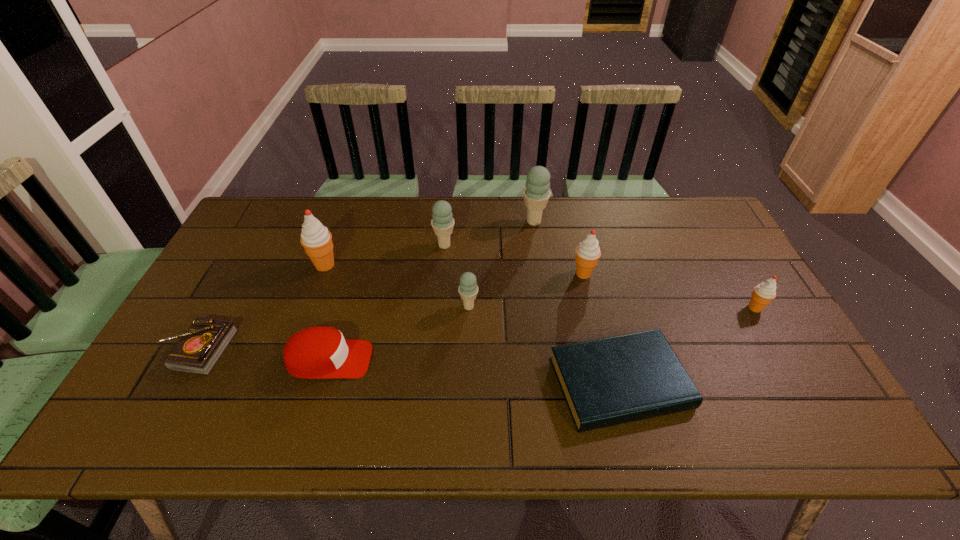
Locate an element on the screen. Image resolution: width=960 pixels, height=540 pixels. vacant space at the right edge is located at coordinates (742, 269).

This screenshot has height=540, width=960. In the image, there is a desktop. Identify the location of free region at the far left corner. (273, 212).

The image size is (960, 540). I want to click on free space at the near left corner of the desktop, so click(x=188, y=434).

In the image, there is a desktop. In order to click on blank space at the far right corner in this screenshot , I will do `click(708, 210)`.

Identify the location of free space between the rightmost red icecream and the book. (687, 346).

The height and width of the screenshot is (540, 960). What are the coordinates of `vacant space that's between the second red icecream from left to right and the second ice cream from left to right` in the screenshot? It's located at (514, 259).

In order to click on empty location between the second smallest red icecream and the rightmost blue ice cream in this screenshot , I will do `click(559, 248)`.

This screenshot has height=540, width=960. In order to click on unoccupied area between the biggest red icecream and the second red icecream from right to left in this screenshot , I will do `click(454, 269)`.

Image resolution: width=960 pixels, height=540 pixels. In order to click on empty location between the leftmost object and the second nearest blue ice cream in this screenshot , I will do `click(322, 298)`.

Locate an element on the screen. free space between the rightmost ice cream and the leftmost ice cream is located at coordinates (540, 286).